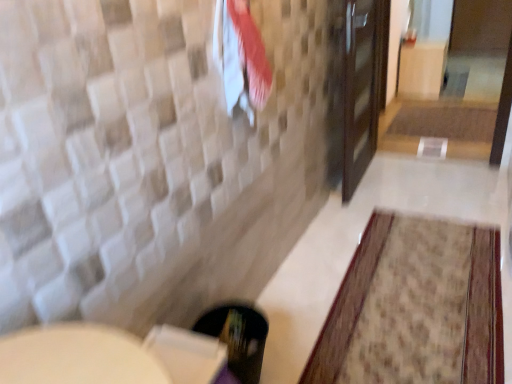
Question: Is beige textured rug at lower right, placed as the first bath mat when sorted from left to right, completely or partially inside white cotton beach towel at upper center?

Choices:
 (A) yes
 (B) no

Answer: (B)

Question: Considering the relative sizes of white cotton beach towel at upper center and beige textured rug at lower right, positioned as the 2th bath mat in top-to-bottom order, in the image provided, is white cotton beach towel at upper center bigger than beige textured rug at lower right, positioned as the 2th bath mat in top-to-bottom order,?

Choices:
 (A) no
 (B) yes

Answer: (A)

Question: Can you confirm if white cotton beach towel at upper center is thinner than beige textured rug at lower right, the second bath mat viewed from the right?

Choices:
 (A) no
 (B) yes

Answer: (B)

Question: Is there a large distance between white cotton beach towel at upper center and beige textured rug at lower right, the second bath mat positioned from the back?

Choices:
 (A) yes
 (B) no

Answer: (A)

Question: From the image's perspective, is white cotton beach towel at upper center located beneath beige textured rug at lower right, the 1th bath mat ordered from the bottom?

Choices:
 (A) yes
 (B) no

Answer: (B)

Question: Based on their positions, is white cotton beach towel at upper center located to the left or right of brown textured bath mat at center, positioned as the 1th bath mat in top-to-bottom order?

Choices:
 (A) right
 (B) left

Answer: (B)

Question: Is point (251, 99) closer or farther from the camera than point (458, 139)?

Choices:
 (A) closer
 (B) farther

Answer: (A)

Question: Looking at their shapes, would you say white cotton beach towel at upper center is wider or thinner than brown textured bath mat at center, the 1th bath mat from the back?

Choices:
 (A) wide
 (B) thin

Answer: (B)

Question: From their relative heights in the image, would you say white cotton beach towel at upper center is taller or shorter than brown textured bath mat at center, placed as the first bath mat when sorted from right to left?

Choices:
 (A) short
 (B) tall

Answer: (B)

Question: Considering the positions of white cotton beach towel at upper center and beige textured rug at lower right, the second bath mat viewed from the right, in the image, is white cotton beach towel at upper center taller or shorter than beige textured rug at lower right, the second bath mat viewed from the right,?

Choices:
 (A) short
 (B) tall

Answer: (B)

Question: Based on their positions, is white cotton beach towel at upper center located to the left or right of beige textured rug at lower right, positioned as the 2th bath mat in top-to-bottom order?

Choices:
 (A) left
 (B) right

Answer: (A)

Question: From the image's perspective, is white cotton beach towel at upper center located above or below beige textured rug at lower right, placed as the first bath mat when sorted from left to right?

Choices:
 (A) above
 (B) below

Answer: (A)

Question: Is white cotton beach towel at upper center in front of or behind beige textured rug at lower right, the first bath mat viewed from the front, in the image?

Choices:
 (A) front
 (B) behind

Answer: (A)

Question: Is point (478, 115) positioned closer to the camera than point (260, 92)?

Choices:
 (A) closer
 (B) farther

Answer: (B)

Question: Is brown textured bath mat at center, the 2th bath mat viewed from the front, spatially inside white cotton beach towel at upper center, or outside of it?

Choices:
 (A) inside
 (B) outside

Answer: (B)